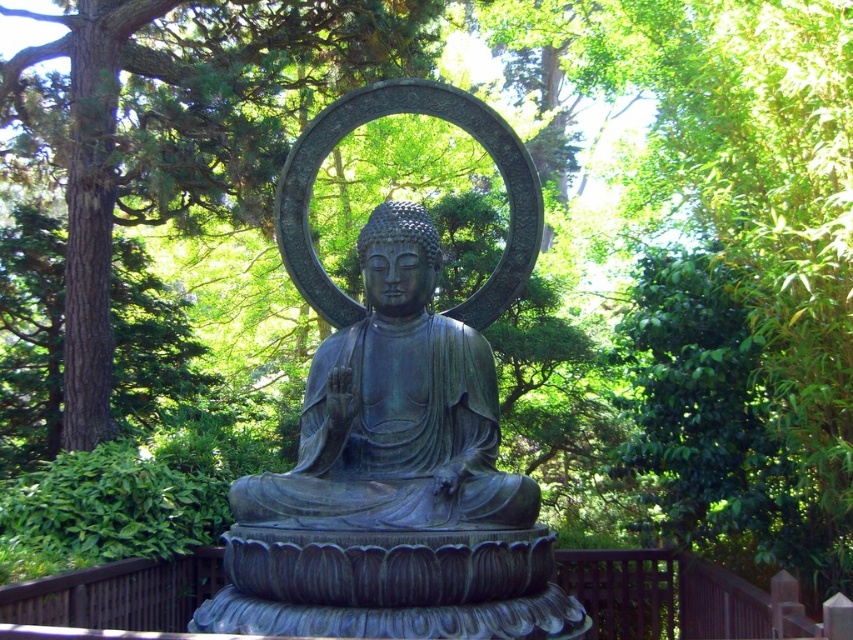
Which is more to the right, green leafy tree at center or green patina statue at center?

From the viewer's perspective, green patina statue at center appears more on the right side.

Measure the distance between green leafy tree at center and camera.

41.78 feet

At what (x,y) coordinates should I click in order to perform the action: click on green leafy tree at center. Please return your answer as a coordinate pair (x, y). This screenshot has width=853, height=640. Looking at the image, I should click on (184, 129).

Is bronze statue at center to the right of green patina statue at center from the viewer's perspective?

Correct, you'll find bronze statue at center to the right of green patina statue at center.

The width and height of the screenshot is (853, 640). In order to click on bronze statue at center in this screenshot , I will do `click(396, 428)`.

Which is more to the left, bronze statue at center or green leafy tree at center?

green leafy tree at center

Which of these two, bronze statue at center or green leafy tree at center, stands shorter?

green leafy tree at center is shorter.

Is point (471, 444) less distant than point (328, 54)?

Yes.

Locate an element on the screen. This screenshot has width=853, height=640. bronze statue at center is located at coordinates (396, 428).